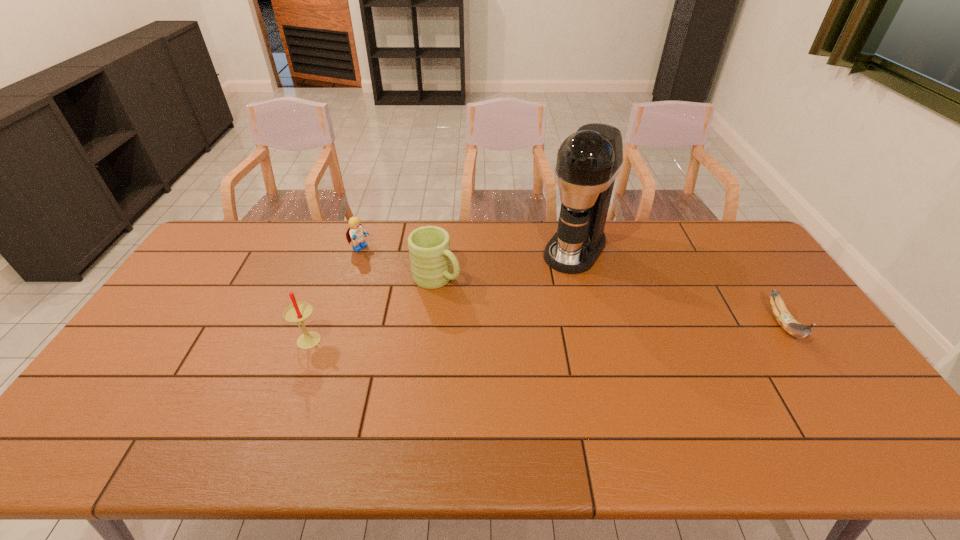
Locate an element on the screen. The image size is (960, 540). vacant space positioned 0.250m on the side of the third tallest object with the handle is located at coordinates (517, 328).

You are a GUI agent. You are given a task and a screenshot of the screen. Output one action in this format:
    pyautogui.click(x=<x>, y=<y>)
    Task: Click on the free spot located on the side of the third tallest object with the handle
    
    Given the screenshot: What is the action you would take?
    pyautogui.click(x=517, y=328)

The height and width of the screenshot is (540, 960). I want to click on vacant space located on the side of the third tallest object with the handle, so click(x=558, y=354).

At what (x,y) coordinates should I click in order to perform the action: click on vacant area located place cup under the spout of the coffee maker. Please return your answer as a coordinate pair (x, y). Looking at the image, I should click on (540, 301).

Identify the location of free space located place cup under the spout of the coffee maker. The image size is (960, 540). click(x=535, y=309).

Locate an element on the screen. The width and height of the screenshot is (960, 540). vacant space located 0.260m place cup under the spout of the coffee maker is located at coordinates (527, 320).

Locate an element on the screen. free space located 0.120m on the front-facing side of the Lego is located at coordinates (389, 269).

The width and height of the screenshot is (960, 540). What are the coordinates of `free space located on the front-facing side of the Lego` in the screenshot? It's located at click(x=414, y=286).

Identify the location of free location located 0.050m on the front-facing side of the Lego. This screenshot has width=960, height=540. (375, 260).

Identify the location of coffee maker present at the far edge. This screenshot has height=540, width=960. (588, 161).